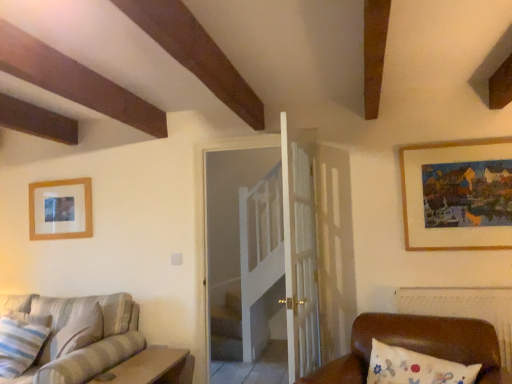
Question: Does wooden framed painting at upper right, marked as the second picture frame in a left-to-right arrangement, appear on the left side of striped fabric pillow at lower left?

Choices:
 (A) yes
 (B) no

Answer: (B)

Question: Is wooden framed painting at upper right, marked as the second picture frame in a left-to-right arrangement, wider than striped fabric pillow at lower left?

Choices:
 (A) no
 (B) yes

Answer: (A)

Question: Is wooden framed painting at upper right, the 1th picture frame from the right, positioned with its back to striped fabric pillow at lower left?

Choices:
 (A) yes
 (B) no

Answer: (B)

Question: Is wooden framed painting at upper right, marked as the second picture frame in a left-to-right arrangement, closer to the viewer compared to striped fabric pillow at lower left?

Choices:
 (A) yes
 (B) no

Answer: (A)

Question: Does wooden framed painting at upper right, marked as the first picture frame in a front-to-back arrangement, have a lesser height compared to striped fabric pillow at lower left?

Choices:
 (A) yes
 (B) no

Answer: (B)

Question: From a real-world perspective, is striped fabric pillow at lower left positioned above or below striped fabric couch at lower left?

Choices:
 (A) below
 (B) above

Answer: (B)

Question: Is striped fabric pillow at lower left bigger or smaller than striped fabric couch at lower left?

Choices:
 (A) small
 (B) big

Answer: (A)

Question: Does point (0, 375) appear closer or farther from the camera than point (100, 365)?

Choices:
 (A) closer
 (B) farther

Answer: (B)

Question: Relative to striped fabric couch at lower left, is striped fabric pillow at lower left in front or behind?

Choices:
 (A) behind
 (B) front

Answer: (A)

Question: From the image's perspective, is striped fabric couch at lower left above or below brown leather couch at lower right?

Choices:
 (A) below
 (B) above

Answer: (A)

Question: Which is correct: striped fabric couch at lower left is inside brown leather couch at lower right, or outside of it?

Choices:
 (A) inside
 (B) outside

Answer: (B)

Question: In terms of width, does striped fabric couch at lower left look wider or thinner when compared to brown leather couch at lower right?

Choices:
 (A) wide
 (B) thin

Answer: (A)

Question: Considering the positions of striped fabric couch at lower left and brown leather couch at lower right in the image, is striped fabric couch at lower left bigger or smaller than brown leather couch at lower right?

Choices:
 (A) big
 (B) small

Answer: (A)

Question: From a real-world perspective, is brown leather couch at lower right above or below striped fabric pillow at lower left?

Choices:
 (A) above
 (B) below

Answer: (A)

Question: From the image's perspective, is brown leather couch at lower right above or below striped fabric pillow at lower left?

Choices:
 (A) above
 (B) below

Answer: (A)